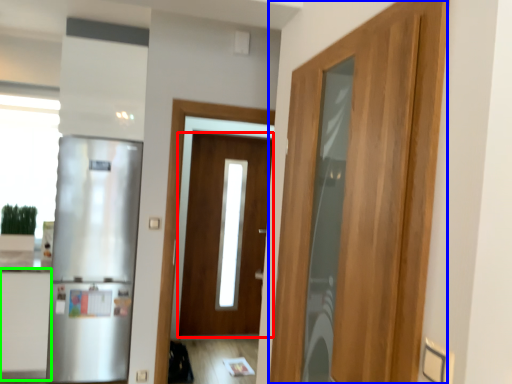
Question: Based on their relative distances, which object is nearer to door (highlighted by a red box)? Choose from door (highlighted by a blue box) and cabinetry (highlighted by a green box).

Choices:
 (A) door
 (B) cabinetry

Answer: (B)